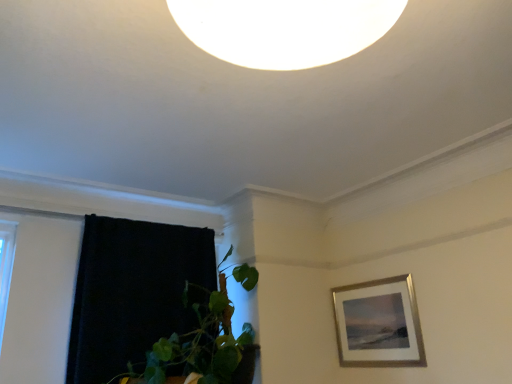
You are a GUI agent. You are given a task and a screenshot of the screen. Output one action in this format:
    pyautogui.click(x=<x>, y=<y>)
    Task: Click on the green leafy plant at lower left
    This screenshot has width=512, height=384.
    Given the screenshot: What is the action you would take?
    pyautogui.click(x=197, y=343)

I want to click on black velvet curtain at left, so click(134, 292).

From a real-world perspective, is black velvet curtain at left below silver/metallic picture frame at upper right?

Incorrect, from a real-world perspective, black velvet curtain at left is higher than silver/metallic picture frame at upper right.

Considering the positions of point (125, 352) and point (419, 343), is point (125, 352) closer or farther from the camera than point (419, 343)?

Point (125, 352) is closer to the camera than point (419, 343).

From the picture: Does black velvet curtain at left have a greater height compared to silver/metallic picture frame at upper right?

Yes.

Considering the relative positions of black velvet curtain at left and silver/metallic picture frame at upper right in the image provided, is black velvet curtain at left to the left of silver/metallic picture frame at upper right from the viewer's perspective?

Correct, you'll find black velvet curtain at left to the left of silver/metallic picture frame at upper right.

In terms of size, does green leafy plant at lower left appear bigger or smaller than black velvet curtain at left?

Clearly, green leafy plant at lower left is larger in size than black velvet curtain at left.

Can you tell me how much green leafy plant at lower left and black velvet curtain at left differ in facing direction?

There is a 13-degree angle between the facing directions of green leafy plant at lower left and black velvet curtain at left.

Which is less distant, [224,338] or [117,299]?

Point [117,299]

Between green leafy plant at lower left and black velvet curtain at left, which one appears on the left side from the viewer's perspective?

Positioned to the left is black velvet curtain at left.

Is silver/metallic picture frame at upper right thinner than black velvet curtain at left?

Indeed, silver/metallic picture frame at upper right has a lesser width compared to black velvet curtain at left.

From a real-world perspective, which object stands above the other?

From a 3D spatial view, black velvet curtain at left is above.

How much distance is there between silver/metallic picture frame at upper right and black velvet curtain at left?

silver/metallic picture frame at upper right and black velvet curtain at left are 4.58 feet apart from each other.

Is silver/metallic picture frame at upper right in contact with black velvet curtain at left?

silver/metallic picture frame at upper right and black velvet curtain at left are clearly separated.

How many degrees apart are the facing directions of black velvet curtain at left and green leafy plant at lower left?

There is a 13-degree angle between the facing directions of black velvet curtain at left and green leafy plant at lower left.

Consider the image. From the image's perspective, which object appears higher, black velvet curtain at left or green leafy plant at lower left?

green leafy plant at lower left, from the image's perspective.

From a real-world perspective, which object stands above the other?

black velvet curtain at left.

Could you tell me if black velvet curtain at left is turned towards green leafy plant at lower left?

Yes, black velvet curtain at left is oriented towards green leafy plant at lower left.

Looking at this image, in terms of height, does silver/metallic picture frame at upper right look taller or shorter compared to green leafy plant at lower left?

In the image, silver/metallic picture frame at upper right appears to be shorter than green leafy plant at lower left.

From a real-world perspective, relative to green leafy plant at lower left, is silver/metallic picture frame at upper right vertically above or below?

From a real-world perspective, silver/metallic picture frame at upper right is physically below green leafy plant at lower left.

What's the angular difference between silver/metallic picture frame at upper right and green leafy plant at lower left's facing directions?

There is a 83.6-degree angle between the facing directions of silver/metallic picture frame at upper right and green leafy plant at lower left.

Is green leafy plant at lower left surrounded by silver/metallic picture frame at upper right?

No, green leafy plant at lower left is not inside silver/metallic picture frame at upper right.

Locate an element on the screen. The height and width of the screenshot is (384, 512). picture frame to the right of green leafy plant at lower left is located at coordinates (378, 323).

Is green leafy plant at lower left spatially inside silver/metallic picture frame at upper right, or outside of it?

green leafy plant at lower left is outside silver/metallic picture frame at upper right.

Does green leafy plant at lower left have a greater height compared to silver/metallic picture frame at upper right?

Indeed, green leafy plant at lower left has a greater height compared to silver/metallic picture frame at upper right.

From the image's perspective, is green leafy plant at lower left below silver/metallic picture frame at upper right?

Actually, green leafy plant at lower left appears above silver/metallic picture frame at upper right in the image.

Where is `picture frame that is behind the black velvet curtain at left`? picture frame that is behind the black velvet curtain at left is located at coordinates (378, 323).

This screenshot has height=384, width=512. Find the location of `curtain above the green leafy plant at lower left (from a real-world perspective)`. curtain above the green leafy plant at lower left (from a real-world perspective) is located at coordinates (134, 292).

Considering their positions, is green leafy plant at lower left positioned further to black velvet curtain at left than silver/metallic picture frame at upper right?

silver/metallic picture frame at upper right.

When comparing their distances from green leafy plant at lower left, does black velvet curtain at left or silver/metallic picture frame at upper right seem closer?

Based on the image, black velvet curtain at left appears to be nearer to green leafy plant at lower left.

When comparing their distances from green leafy plant at lower left, does silver/metallic picture frame at upper right or black velvet curtain at left seem closer?

black velvet curtain at left is closer to green leafy plant at lower left.

Looking at the image, which one is located closer to black velvet curtain at left, silver/metallic picture frame at upper right or green leafy plant at lower left?

green leafy plant at lower left lies closer to black velvet curtain at left than the other object.

From the image, which object appears to be nearer to silver/metallic picture frame at upper right, black velvet curtain at left or green leafy plant at lower left?

Based on the image, green leafy plant at lower left appears to be nearer to silver/metallic picture frame at upper right.

Considering their positions, is green leafy plant at lower left positioned closer to silver/metallic picture frame at upper right than black velvet curtain at left?

green leafy plant at lower left.

In order to click on houseplant between black velvet curtain at left and silver/metallic picture frame at upper right in the horizontal direction in this screenshot , I will do `click(197, 343)`.